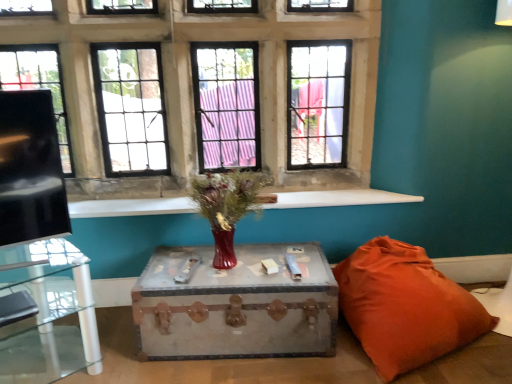
Question: From a real-world perspective, is matte glass vase at center over orange fabric pillow at lower right?

Choices:
 (A) yes
 (B) no

Answer: (A)

Question: Are matte glass vase at center and orange fabric pillow at lower right located far from each other?

Choices:
 (A) yes
 (B) no

Answer: (B)

Question: From the image's perspective, is matte glass vase at center above orange fabric pillow at lower right?

Choices:
 (A) no
 (B) yes

Answer: (B)

Question: From the image's perspective, would you say matte glass vase at center is shown under orange fabric pillow at lower right?

Choices:
 (A) no
 (B) yes

Answer: (A)

Question: Is matte glass vase at center facing towards orange fabric pillow at lower right?

Choices:
 (A) no
 (B) yes

Answer: (A)

Question: From their relative heights in the image, would you say matte glass vase at center is taller or shorter than clear glass table at left, which is counted as the first table, starting from the left?

Choices:
 (A) short
 (B) tall

Answer: (A)

Question: Based on their positions, is matte glass vase at center located to the left or right of clear glass table at left, the 2th table when ordered from right to left?

Choices:
 (A) right
 (B) left

Answer: (A)

Question: Which is correct: matte glass vase at center is inside clear glass table at left, the 2th table when ordered from right to left, or outside of it?

Choices:
 (A) outside
 (B) inside

Answer: (A)

Question: Is matte glass vase at center wider or thinner than clear glass table at left, which is counted as the first table, starting from the left?

Choices:
 (A) wide
 (B) thin

Answer: (B)

Question: Is clear glass table at left, which is counted as the first table, starting from the left, wider or thinner than white marble window sill at center?

Choices:
 (A) thin
 (B) wide

Answer: (B)

Question: From a real-world perspective, relative to white marble window sill at center, is clear glass table at left, the 2th table when ordered from right to left, vertically above or below?

Choices:
 (A) below
 (B) above

Answer: (A)

Question: From the image's perspective, is clear glass table at left, the 2th table when ordered from right to left, positioned above or below white marble window sill at center?

Choices:
 (A) below
 (B) above

Answer: (A)

Question: Does point (71, 264) appear closer or farther from the camera than point (73, 208)?

Choices:
 (A) closer
 (B) farther

Answer: (A)

Question: Considering the positions of clear glass table at left, which is counted as the first table, starting from the left, and matte glass vase at center in the image, is clear glass table at left, which is counted as the first table, starting from the left, wider or thinner than matte glass vase at center?

Choices:
 (A) thin
 (B) wide

Answer: (B)

Question: Would you say clear glass table at left, the 2th table when ordered from right to left, is to the left or to the right of matte glass vase at center in the picture?

Choices:
 (A) right
 (B) left

Answer: (B)